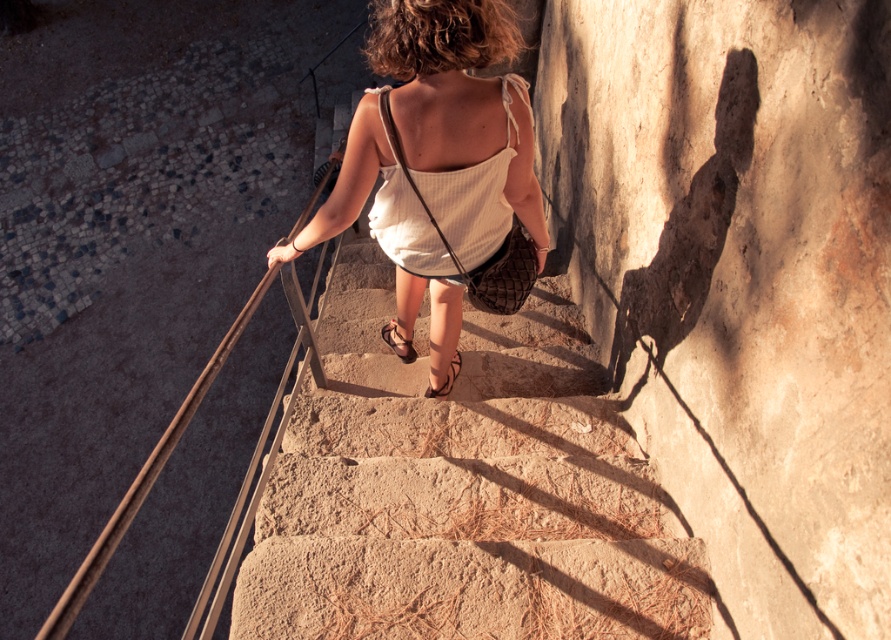
Who is more forward, (409,353) or (452,364)?

Point (452,364) is more forward.

Can you confirm if matte brown sandal at center is positioned to the right of brown leather sandal at center?

In fact, matte brown sandal at center is to the left of brown leather sandal at center.

Which is behind, point (409, 340) or point (434, 392)?

The point (409, 340) is more distant.

What are the coordinates of `matte brown sandal at center` in the screenshot? It's located at (397, 342).

Can you confirm if matte white tank top at center is thinner than brown leather sandal at center?

No.

Can you confirm if matte white tank top at center is smaller than brown leather sandal at center?

No.

Find the location of a particular element. matte white tank top at center is located at coordinates (462, 116).

In the scene shown: Does stone textured stairs at center have a larger size compared to white ribbed fabric dress at center?

Correct, stone textured stairs at center is larger in size than white ribbed fabric dress at center.

Between stone textured stairs at center and white ribbed fabric dress at center, which one is positioned lower?

Positioned lower is stone textured stairs at center.

Where is `stone textured stairs at center`? Image resolution: width=891 pixels, height=640 pixels. stone textured stairs at center is located at coordinates (463, 492).

This screenshot has width=891, height=640. What are the coordinates of `stone textured stairs at center` in the screenshot? It's located at (463, 492).